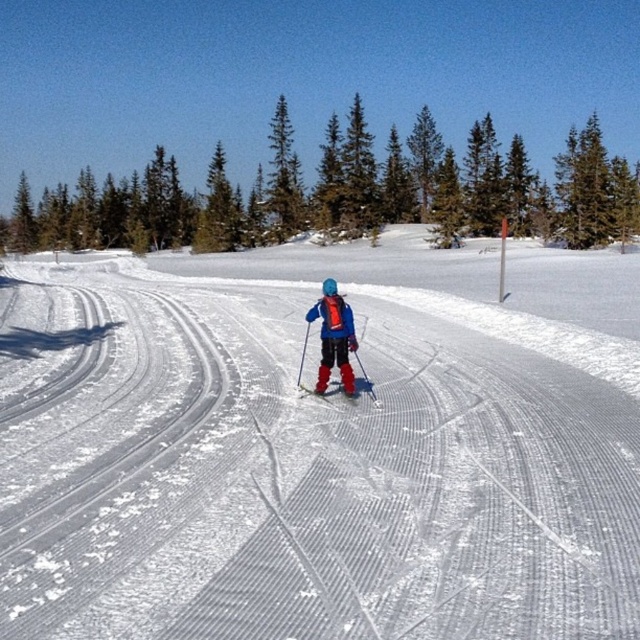
Question: Among these objects, which one is nearest to the camera?

Choices:
 (A) matte red ski at center
 (B) white textured snow at center

Answer: (B)

Question: In this image, where is white textured snow at center located relative to matte blue ski suit at center?

Choices:
 (A) above
 (B) below

Answer: (A)

Question: Among these objects, which one is farthest from the camera?

Choices:
 (A) white textured snow at center
 (B) matte red ski at center
 (C) matte blue ski suit at center
 (D) green coniferous trees at upper center

Answer: (D)

Question: Which point is closer to the camera?

Choices:
 (A) (310, 307)
 (B) (368, 148)

Answer: (A)

Question: Is green coniferous trees at upper center wider than matte red ski at center?

Choices:
 (A) no
 (B) yes

Answer: (B)

Question: Does green coniferous trees at upper center appear over matte blue ski suit at center?

Choices:
 (A) no
 (B) yes

Answer: (B)